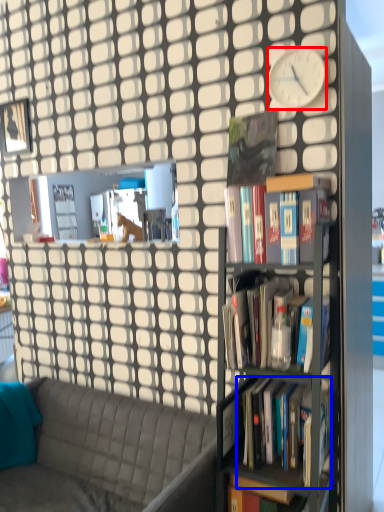
Question: Which point is further to the camera, clock (highlighted by a red box) or book (highlighted by a blue box)?

Choices:
 (A) clock
 (B) book

Answer: (A)